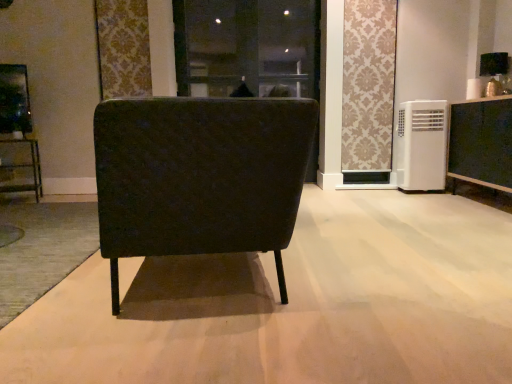
What is the approximate width of metallic silver shelf at left?

The width of metallic silver shelf at left is 15.43 inches.

At what (x,y) coordinates should I click in order to perform the action: click on black fabric screen door at center. Please return your answer as a coordinate pair (x, y). The height and width of the screenshot is (384, 512). Looking at the image, I should click on (247, 48).

Find the location of a particular element. This screenshot has width=512, height=384. matte black cabinet at right is located at coordinates (481, 143).

What do you see at coordinates (199, 176) in the screenshot? The image size is (512, 384). I see `matte black chair at center` at bounding box center [199, 176].

You are a GUI agent. You are given a task and a screenshot of the screen. Output one action in this format:
    pyautogui.click(x=<x>, y=<y>)
    Task: Click on the matte black chair at center
    Image resolution: width=512 pixels, height=384 pixels.
    Given the screenshot: What is the action you would take?
    pyautogui.click(x=199, y=176)

The height and width of the screenshot is (384, 512). I want to click on metallic silver shelf at left, so click(24, 168).

Which object is closer to the camera, metallic silver shelf at left or matte black chair at center?

matte black chair at center is in front.

Which point is more forward, [36,183] or [173,182]?

Point [173,182]

From the image's perspective, does metallic silver shelf at left appear higher than matte black chair at center?

Indeed, from the image's perspective, metallic silver shelf at left is shown above matte black chair at center.

Is metallic silver shelf at left directly adjacent to matte black chair at center?

No, metallic silver shelf at left is not making contact with matte black chair at center.

Between black fabric screen door at center and patterned fabric curtain at upper center, which one has more height?

Standing taller between the two is black fabric screen door at center.

Between black fabric screen door at center and patterned fabric curtain at upper center, which one has smaller size?

With smaller size is patterned fabric curtain at upper center.

Can you see black fabric screen door at center touching patterned fabric curtain at upper center?

No, black fabric screen door at center is not touching patterned fabric curtain at upper center.

Considering the positions of points (180, 22) and (350, 138), is point (180, 22) closer to camera compared to point (350, 138)?

No, it is not.

From the image's perspective, is metallic silver shelf at left below matte black cabinet at right?

Yes, from the image's perspective, metallic silver shelf at left is below matte black cabinet at right.

Considering the relative sizes of metallic silver shelf at left and matte black cabinet at right in the image provided, is metallic silver shelf at left thinner than matte black cabinet at right?

Yes.

Which object is more forward, metallic silver shelf at left or matte black cabinet at right?

Positioned in front is matte black cabinet at right.

Does point (39, 187) lie in front of point (505, 184)?

No, it is behind (505, 184).

Locate an element on the screen. This screenshot has height=384, width=512. cabinetry located on the right of black fabric screen door at center is located at coordinates [481, 143].

Can you confirm if matte black cabinet at right is positioned to the right of black fabric screen door at center?

Yes.

Is point (466, 176) farther from camera compared to point (174, 28)?

That is False.

From the image's perspective, is matte black cabinet at right above or below black fabric screen door at center?

matte black cabinet at right is below black fabric screen door at center.

From a real-world perspective, which is physically above, white plastic air conditioner at right or black fabric screen door at center?

In real-world perspective, black fabric screen door at center is above.

Is white plastic air conditioner at right positioned far away from black fabric screen door at center?

Yes, white plastic air conditioner at right is far from black fabric screen door at center.

Between white plastic air conditioner at right and black fabric screen door at center, which one appears on the right side from the viewer's perspective?

From the viewer's perspective, white plastic air conditioner at right appears more on the right side.

How distant is white plastic air conditioner at right from black fabric screen door at center?

A distance of 6.19 feet exists between white plastic air conditioner at right and black fabric screen door at center.

Who is smaller, patterned fabric curtain at upper center or white plastic air conditioner at right?

patterned fabric curtain at upper center is smaller.

From the image's perspective, is patterned fabric curtain at upper center above or below white plastic air conditioner at right?

Clearly, from the image's perspective, patterned fabric curtain at upper center is above white plastic air conditioner at right.

From a real-world perspective, who is located higher, patterned fabric curtain at upper center or white plastic air conditioner at right?

In real-world perspective, patterned fabric curtain at upper center is above.

Is patterned fabric curtain at upper center placed right next to white plastic air conditioner at right?

patterned fabric curtain at upper center is not next to white plastic air conditioner at right, and they're not touching.

How different are the orientations of black fabric screen door at center and white plastic air conditioner at right in degrees?

They differ by 1.02 degrees in their facing directions.

Consider the image. Is black fabric screen door at center at the right side of white plastic air conditioner at right?

No.

Which object is further away from the camera, black fabric screen door at center or white plastic air conditioner at right?

black fabric screen door at center is behind.

The width and height of the screenshot is (512, 384). In order to click on chair below the metallic silver shelf at left (from the image's perspective) in this screenshot , I will do `click(199, 176)`.

At what (x,y) coordinates should I click in order to perform the action: click on curtain below the black fabric screen door at center (from a real-world perspective). Please return your answer as a coordinate pair (x, y). The image size is (512, 384). Looking at the image, I should click on (368, 85).

Based on their spatial positions, is patterned fabric curtain at upper center or matte black chair at center further from matte black cabinet at right?

matte black chair at center.

When comparing their distances from white plastic air conditioner at right, does metallic silver shelf at left or patterned fabric curtain at upper center seem further?

metallic silver shelf at left is positioned further to the anchor white plastic air conditioner at right.

When comparing their distances from black fabric screen door at center, does matte black chair at center or metallic silver shelf at left seem further?

matte black chair at center.

Looking at the image, which one is located further to white plastic air conditioner at right, matte black cabinet at right or matte black chair at center?

Based on the image, matte black chair at center appears to be further to white plastic air conditioner at right.

Considering their positions, is black fabric screen door at center positioned further to metallic silver shelf at left than matte black cabinet at right?

The object further to metallic silver shelf at left is matte black cabinet at right.

Based on their spatial positions, is black fabric screen door at center or matte black chair at center closer to white plastic air conditioner at right?

Based on the image, black fabric screen door at center appears to be nearer to white plastic air conditioner at right.

Based on their spatial positions, is matte black chair at center or patterned fabric curtain at upper center further from white plastic air conditioner at right?

Based on the image, matte black chair at center appears to be further to white plastic air conditioner at right.

Looking at the image, which one is located further to white plastic air conditioner at right, metallic silver shelf at left or black fabric screen door at center?

metallic silver shelf at left is positioned further to the anchor white plastic air conditioner at right.

Image resolution: width=512 pixels, height=384 pixels. Find the location of `curtain between metallic silver shelf at left and white plastic air conditioner at right from left to right`. curtain between metallic silver shelf at left and white plastic air conditioner at right from left to right is located at coordinates (368, 85).

Where is `screen door between metallic silver shelf at left and patterned fabric curtain at upper center`? This screenshot has height=384, width=512. screen door between metallic silver shelf at left and patterned fabric curtain at upper center is located at coordinates (247, 48).

The image size is (512, 384). I want to click on air conditioner between matte black cabinet at right and patterned fabric curtain at upper center along the z-axis, so 421,145.

Find the location of a particular element. This screenshot has width=512, height=384. air conditioner located between metallic silver shelf at left and matte black cabinet at right in the left-right direction is located at coordinates (421, 145).